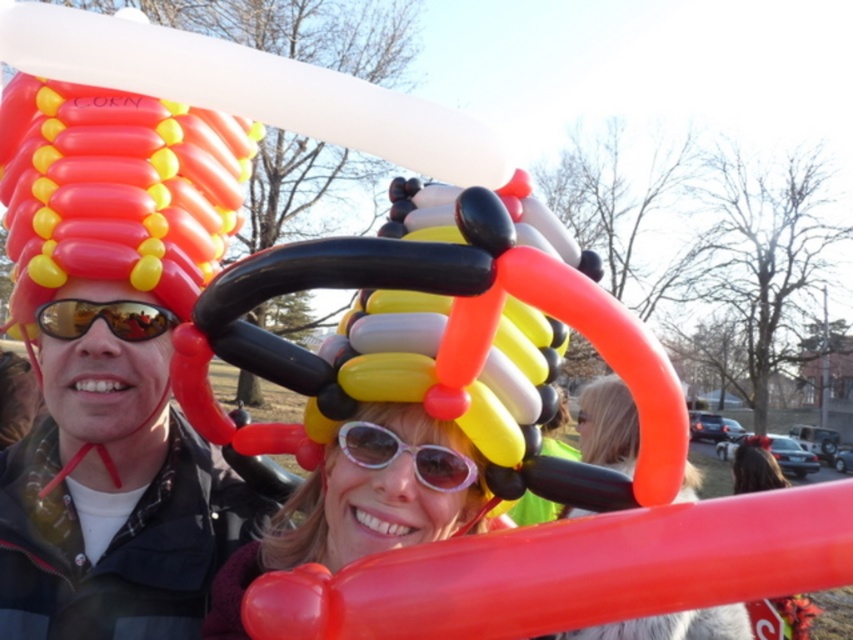
Question: Does matte black sunglasses at upper left have a larger size compared to matte black sunglasses at center?

Choices:
 (A) no
 (B) yes

Answer: (B)

Question: Among these points, which one is farthest from the camera?

Choices:
 (A) (343, 424)
 (B) (84, 326)

Answer: (B)

Question: Which object is closer to the camera taking this photo?

Choices:
 (A) white glossy sunglasses at center
 (B) matte black sunglasses at upper left
 (C) matte black sunglasses at center

Answer: (C)

Question: Among these points, which one is farthest from the camera?

Choices:
 (A) (120, 316)
 (B) (595, 394)
 (C) (433, 468)
 (D) (115, 412)

Answer: (B)

Question: Is matte black sunglasses at center above shiny reflective sunglasses at center?

Choices:
 (A) no
 (B) yes

Answer: (A)

Question: Does matte black sunglasses at upper left appear on the left side of matte orange balloon at center?

Choices:
 (A) no
 (B) yes

Answer: (B)